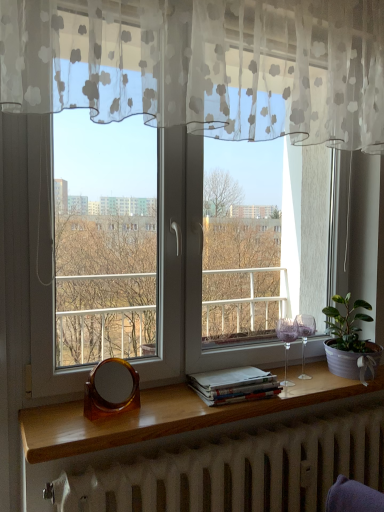
Question: Should I look upward or downward to see white matte radiator at lower center?

Choices:
 (A) down
 (B) up

Answer: (A)

Question: Are white matte radiator at lower center and transparent glass window at center beside each other?

Choices:
 (A) no
 (B) yes

Answer: (A)

Question: Is white matte radiator at lower center not near transparent glass window at center?

Choices:
 (A) yes
 (B) no

Answer: (B)

Question: Is white matte radiator at lower center to the right of transparent glass window at center from the viewer's perspective?

Choices:
 (A) no
 (B) yes

Answer: (B)

Question: From a real-world perspective, is white matte radiator at lower center on top of transparent glass window at center?

Choices:
 (A) no
 (B) yes

Answer: (A)

Question: Can you confirm if white matte radiator at lower center is taller than transparent glass window at center?

Choices:
 (A) no
 (B) yes

Answer: (A)

Question: Is white matte radiator at lower center outside of transparent glass window at center?

Choices:
 (A) yes
 (B) no

Answer: (A)

Question: Is transparent glass window at center smaller than green leafy plant in textured pot at right?

Choices:
 (A) no
 (B) yes

Answer: (A)

Question: Can we say transparent glass window at center lies outside green leafy plant in textured pot at right?

Choices:
 (A) yes
 (B) no

Answer: (A)

Question: From the image's perspective, is transparent glass window at center located beneath green leafy plant in textured pot at right?

Choices:
 (A) yes
 (B) no

Answer: (B)

Question: Is transparent glass window at center next to green leafy plant in textured pot at right?

Choices:
 (A) yes
 (B) no

Answer: (B)

Question: Is transparent glass window at center further to camera compared to green leafy plant in textured pot at right?

Choices:
 (A) yes
 (B) no

Answer: (B)

Question: From a real-world perspective, is transparent glass window at center physically below green leafy plant in textured pot at right?

Choices:
 (A) yes
 (B) no

Answer: (B)

Question: Is the depth of brown tortoiseshell mirror at lower center greater than that of green leafy plant in textured pot at right?

Choices:
 (A) yes
 (B) no

Answer: (B)